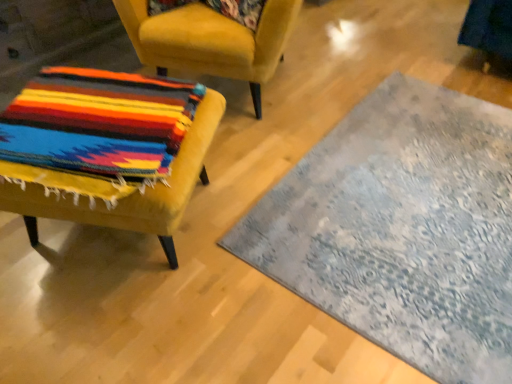
What do you see at coordinates (106, 149) in the screenshot? I see `velvet yellow chair at left, the 1th chair from the bottom` at bounding box center [106, 149].

I want to click on textured gray rug at center, so click(401, 229).

From the image's perspective, is textured gray rug at center on velvet yellow chair at left, the 1th chair from the bottom?

Actually, textured gray rug at center appears below velvet yellow chair at left, the 1th chair from the bottom, in the image.

Is textured gray rug at center completely or partially outside of velvet yellow chair at left, the 2th chair when ordered from top to bottom?

Yes.

Does point (439, 305) come closer to viewer compared to point (103, 111)?

That is False.

Is textured gray rug at center taller or shorter than velvet yellow chair at left, the 1th chair from the bottom?

Considering their sizes, textured gray rug at center has less height than velvet yellow chair at left, the 1th chair from the bottom.

Which object is further away from the camera, velvet yellow chair at left, the 2th chair when ordered from top to bottom, or floral fabric pillow at upper center?

Positioned behind is floral fabric pillow at upper center.

From the picture: Can you see velvet yellow chair at left, the 2th chair when ordered from top to bottom, touching floral fabric pillow at upper center?

No, velvet yellow chair at left, the 2th chair when ordered from top to bottom, is not in contact with floral fabric pillow at upper center.

Is velvet yellow chair at left, the 1th chair from the bottom, positioned beyond the bounds of floral fabric pillow at upper center?

Yes, velvet yellow chair at left, the 1th chair from the bottom, is outside of floral fabric pillow at upper center.

Is velvet yellow chair at left, the 1th chair from the bottom, looking in the opposite direction of textured gray rug at center?

No.

Could textured gray rug at center be considered to be inside velvet yellow chair at left, the 2th chair when ordered from top to bottom?

Definitely not — textured gray rug at center is not inside velvet yellow chair at left, the 2th chair when ordered from top to bottom.

Between point (163, 240) and point (372, 203), which one is positioned behind?

Point (372, 203)

What's the angular difference between velvet yellow chair at left, the 2th chair when ordered from top to bottom, and textured gray rug at center's facing directions?

154 degrees separate the facing orientations of velvet yellow chair at left, the 2th chair when ordered from top to bottom, and textured gray rug at center.

Based on their sizes in the image, would you say multicolored woven fabric at left, the 1th chair in the top-to-bottom sequence, is bigger or smaller than floral fabric pillow at upper center?

Clearly, multicolored woven fabric at left, the 1th chair in the top-to-bottom sequence, is larger in size than floral fabric pillow at upper center.

How much distance is there between multicolored woven fabric at left, the 1th chair in the top-to-bottom sequence, and floral fabric pillow at upper center?

The distance of multicolored woven fabric at left, the 1th chair in the top-to-bottom sequence, from floral fabric pillow at upper center is 8.46 inches.

From a real-world perspective, which object stands above the other?

From a 3D spatial view, floral fabric pillow at upper center is above.

From the image's perspective, count 1st chairs downward from the floral fabric pillow at upper center and point to it. Please provide its 2D coordinates.

[(211, 41)]

Is textured gray rug at center surrounded by floral fabric pillow at upper center?

Definitely not — textured gray rug at center is not inside floral fabric pillow at upper center.

Is floral fabric pillow at upper center positioned in front of textured gray rug at center?

No.

From a real-world perspective, who is located higher, floral fabric pillow at upper center or textured gray rug at center?

In real-world perspective, floral fabric pillow at upper center is above.

Which object is wider, floral fabric pillow at upper center or textured gray rug at center?

textured gray rug at center.

Is textured gray rug at center looking in the opposite direction of multicolored woven fabric at left, the 2th chair positioned from the bottom?

textured gray rug at center is not turned away from multicolored woven fabric at left, the 2th chair positioned from the bottom.

What's the angular difference between textured gray rug at center and multicolored woven fabric at left, the 2th chair positioned from the bottom,'s facing directions?

The angular difference between textured gray rug at center and multicolored woven fabric at left, the 2th chair positioned from the bottom, is 111 degrees.

Which object is further away from the camera taking this photo, textured gray rug at center or multicolored woven fabric at left, the 2th chair positioned from the bottom?

multicolored woven fabric at left, the 2th chair positioned from the bottom, is further from the camera.

From a real-world perspective, which chair is the 2nd one above the textured gray rug at center? Please provide its 2D coordinates.

[(211, 41)]

Which of these two, multicolored woven fabric at left, the 1th chair in the top-to-bottom sequence, or textured gray rug at center, is bigger?

Bigger between the two is multicolored woven fabric at left, the 1th chair in the top-to-bottom sequence.

Is multicolored woven fabric at left, the 1th chair in the top-to-bottom sequence, facing towards textured gray rug at center?

No, multicolored woven fabric at left, the 1th chair in the top-to-bottom sequence, is not oriented towards textured gray rug at center.

Which is behind, multicolored woven fabric at left, the 2th chair positioned from the bottom, or textured gray rug at center?

multicolored woven fabric at left, the 2th chair positioned from the bottom, is further from the camera.

Looking at this image, is multicolored woven fabric at left, the 1th chair in the top-to-bottom sequence, placed right next to textured gray rug at center?

No.

This screenshot has height=384, width=512. In the image, there is a velvet yellow chair at left, the 1th chair from the bottom. Find the location of `mat below it (from a real-world perspective)`. mat below it (from a real-world perspective) is located at coordinates coord(401,229).

The height and width of the screenshot is (384, 512). I want to click on chair that is the 2nd one when counting downward from the floral fabric pillow at upper center (from the image's perspective), so click(x=106, y=149).

Which object lies further to the anchor point textured gray rug at center, multicolored woven fabric at left, the 1th chair in the top-to-bottom sequence, or velvet yellow chair at left, the 2th chair when ordered from top to bottom?

The object further to textured gray rug at center is multicolored woven fabric at left, the 1th chair in the top-to-bottom sequence.

From the image, which object appears to be nearer to multicolored woven fabric at left, the 1th chair in the top-to-bottom sequence, textured gray rug at center or floral fabric pillow at upper center?

floral fabric pillow at upper center lies closer to multicolored woven fabric at left, the 1th chair in the top-to-bottom sequence, than the other object.

From the image, which object appears to be nearer to textured gray rug at center, velvet yellow chair at left, the 2th chair when ordered from top to bottom, or floral fabric pillow at upper center?

velvet yellow chair at left, the 2th chair when ordered from top to bottom, is positioned closer to the anchor textured gray rug at center.

When comparing their distances from multicolored woven fabric at left, the 1th chair in the top-to-bottom sequence, does velvet yellow chair at left, the 2th chair when ordered from top to bottom, or textured gray rug at center seem closer?

Among the two, velvet yellow chair at left, the 2th chair when ordered from top to bottom, is located nearer to multicolored woven fabric at left, the 1th chair in the top-to-bottom sequence.

Estimate the real-world distances between objects in this image. Which object is further from floral fabric pillow at upper center, multicolored woven fabric at left, the 1th chair in the top-to-bottom sequence, or textured gray rug at center?

textured gray rug at center is positioned further to the anchor floral fabric pillow at upper center.

When comparing their distances from velvet yellow chair at left, the 2th chair when ordered from top to bottom, does textured gray rug at center or multicolored woven fabric at left, the 1th chair in the top-to-bottom sequence, seem closer?

The object closer to velvet yellow chair at left, the 2th chair when ordered from top to bottom, is multicolored woven fabric at left, the 1th chair in the top-to-bottom sequence.

Looking at the image, which one is located further to floral fabric pillow at upper center, multicolored woven fabric at left, the 2th chair positioned from the bottom, or velvet yellow chair at left, the 2th chair when ordered from top to bottom?

velvet yellow chair at left, the 2th chair when ordered from top to bottom, is further to floral fabric pillow at upper center.

When comparing their distances from textured gray rug at center, does multicolored woven fabric at left, the 1th chair in the top-to-bottom sequence, or floral fabric pillow at upper center seem closer?

multicolored woven fabric at left, the 1th chair in the top-to-bottom sequence, lies closer to textured gray rug at center than the other object.

Find the location of `pillow between velvet yellow chair at left, the 2th chair when ordered from top to bottom, and textured gray rug at center, in the horizontal direction`. pillow between velvet yellow chair at left, the 2th chair when ordered from top to bottom, and textured gray rug at center, in the horizontal direction is located at coordinates (239, 10).

Identify the location of chair situated between velvet yellow chair at left, the 1th chair from the bottom, and textured gray rug at center from left to right. (211, 41).

Find the location of a particular element. chair that lies between floral fabric pillow at upper center and velvet yellow chair at left, the 2th chair when ordered from top to bottom, from top to bottom is located at coordinates (211, 41).